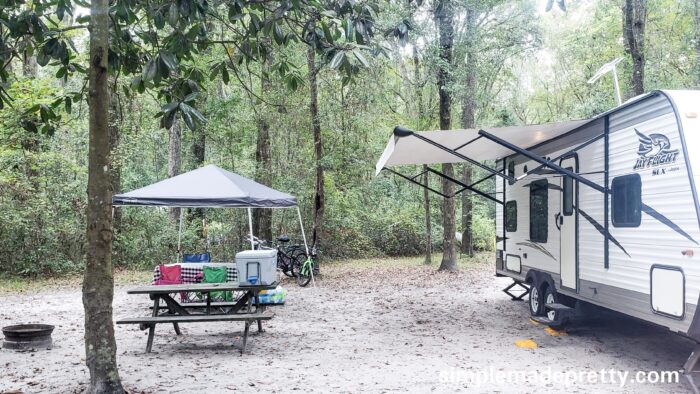
Find the location of a particular element. The width and height of the screenshot is (700, 394). covers is located at coordinates (237, 181), (414, 137).